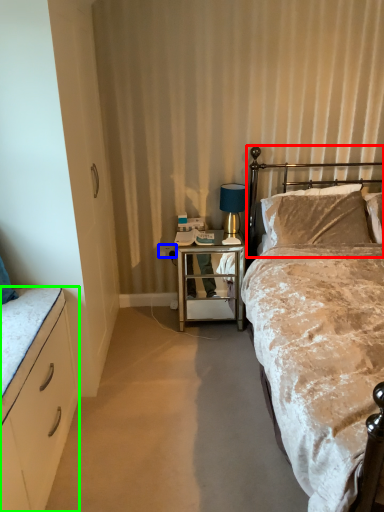
Question: Estimate the real-world distances between objects in this image. Which object is farther from headboard (highlighted by a red box), power outlet (highlighted by a blue box) or cabinetry (highlighted by a green box)?

Choices:
 (A) power outlet
 (B) cabinetry

Answer: (B)